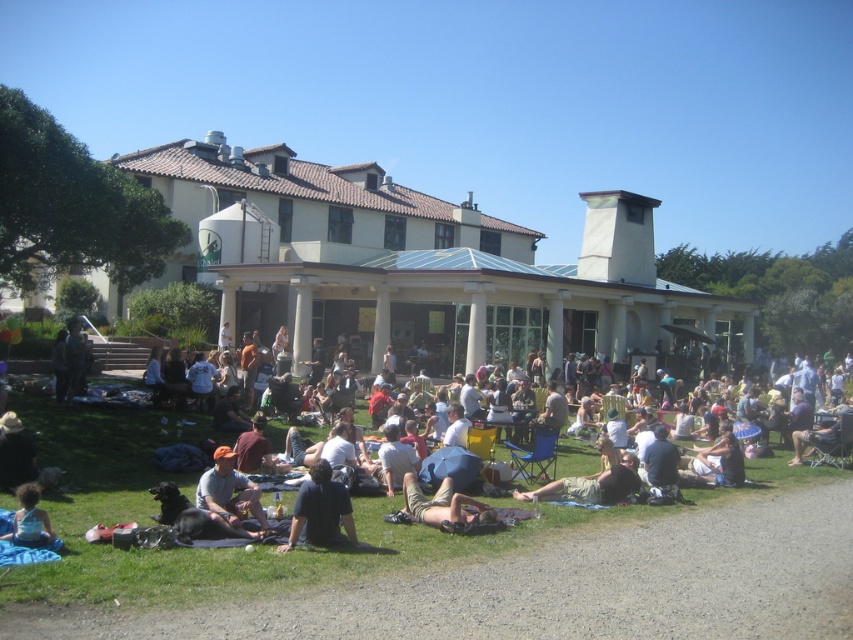
Question: Which of the following is the farthest from the observer?

Choices:
 (A) (15, 515)
 (B) (418, 500)
 (C) (576, 499)

Answer: (C)

Question: Can you confirm if gray cotton shirt at lower center is smaller than blue denim shorts at lower left?

Choices:
 (A) no
 (B) yes

Answer: (A)

Question: Among these points, which one is farthest from the camera?

Choices:
 (A) (453, 522)
 (B) (573, 490)

Answer: (B)

Question: Does tan cotton shorts at lower center have a lesser width compared to blue denim shorts at lower left?

Choices:
 (A) yes
 (B) no

Answer: (B)

Question: Which of the following is the farthest from the observer?

Choices:
 (A) tan cotton shorts at lower center
 (B) dark blue shirt at lower center
 (C) gray cotton shirt at lower center
 (D) light brown fabric blanket at lower center

Answer: (D)

Question: Is dark blue shirt at lower center bigger than blue denim shorts at lower left?

Choices:
 (A) yes
 (B) no

Answer: (A)